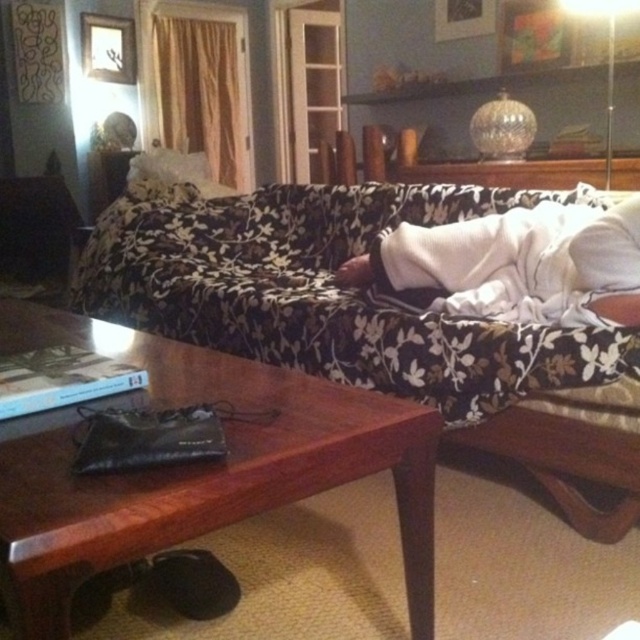
Question: In this image, where is floral fabric couch at center located relative to white soft pillow at upper right?

Choices:
 (A) left
 (B) right

Answer: (A)

Question: Is floral fabric couch at center thinner than white soft pillow at upper right?

Choices:
 (A) yes
 (B) no

Answer: (B)

Question: Which object is closer to the camera taking this photo?

Choices:
 (A) floral fabric couch at center
 (B) white soft blanket at center

Answer: (A)

Question: Considering the real-world distances, which object is farthest from the white soft blanket at center?

Choices:
 (A) floral fabric couch at center
 (B) white soft pillow at upper right

Answer: (A)

Question: Is floral fabric couch at center above white soft pillow at upper right?

Choices:
 (A) yes
 (B) no

Answer: (A)

Question: Which point is closer to the camera?

Choices:
 (A) (593, 227)
 (B) (588, 292)

Answer: (A)